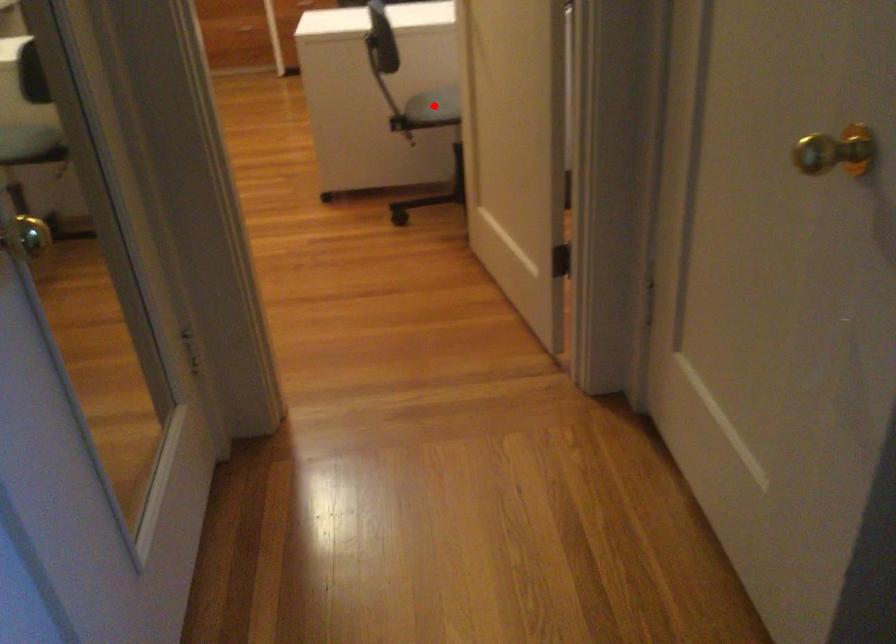
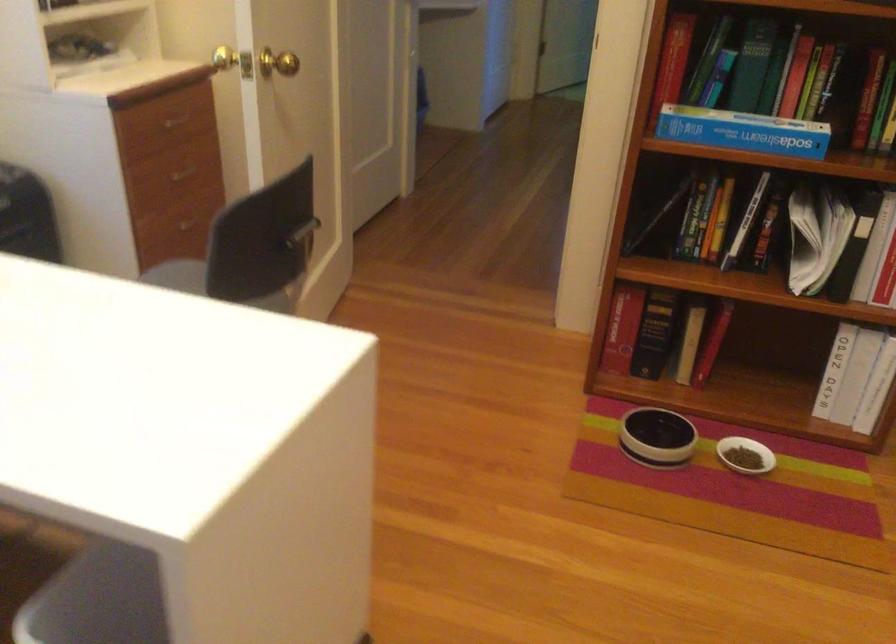
Question: I am providing you with two images of the same scene from different viewpoints. A red point is marked on the first image. Is the red point's position out of view in image 2?

Choices:
 (A) Yes
 (B) No

Answer: (A)